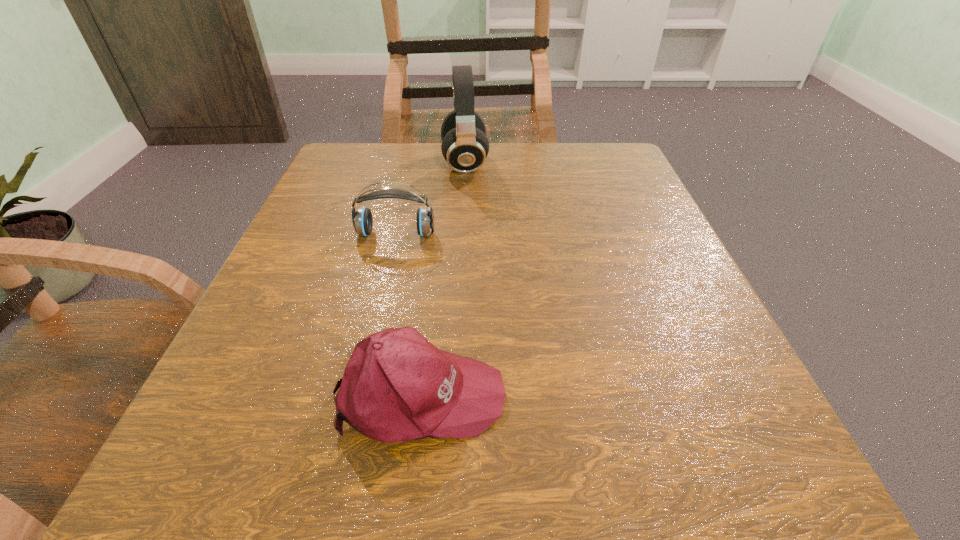
Find the location of `the taller headset`. the taller headset is located at coordinates (465, 146).

Locate an element on the screen. The image size is (960, 540). the tallest object is located at coordinates (465, 146).

Locate an element on the screen. The width and height of the screenshot is (960, 540). the shorter headset is located at coordinates (362, 220).

This screenshot has height=540, width=960. Find the location of `the nearer headset`. the nearer headset is located at coordinates (362, 220).

Identify the location of the nearest object. (397, 386).

Identify the location of free spot located on the ear cups of the farthest object. (556, 163).

At what (x,y) coordinates should I click in order to perform the action: click on vacant space located 0.380m on the ear cups of the second farthest object. Please return your answer as a coordinate pair (x, y). Looking at the image, I should click on (345, 451).

I want to click on free space located at the front of the nearest object with the brim, so click(x=545, y=394).

The width and height of the screenshot is (960, 540). Find the location of `object located in the far edge section of the desktop`. object located in the far edge section of the desktop is located at coordinates (465, 146).

This screenshot has width=960, height=540. What are the coordinates of `object that is positioned at the near edge` in the screenshot? It's located at (397, 386).